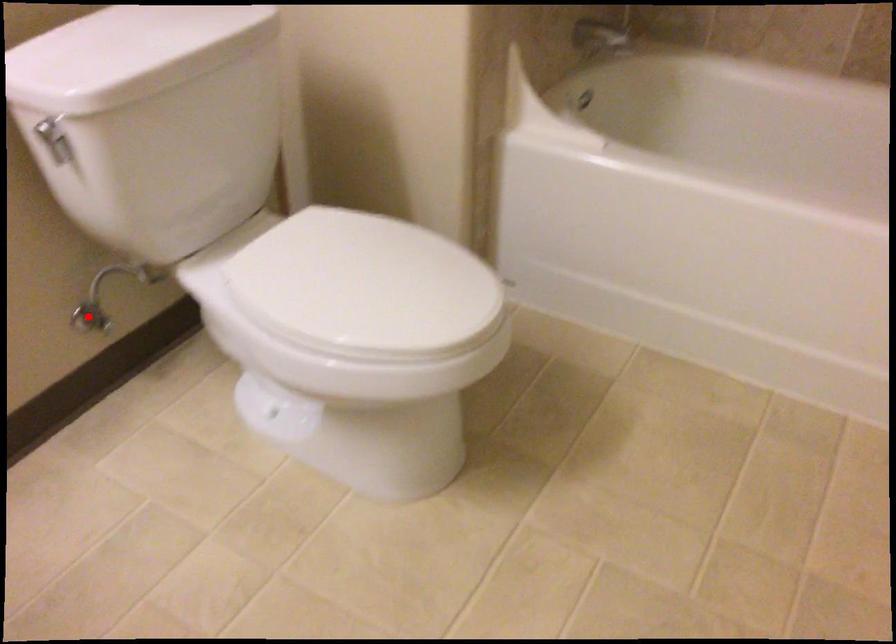
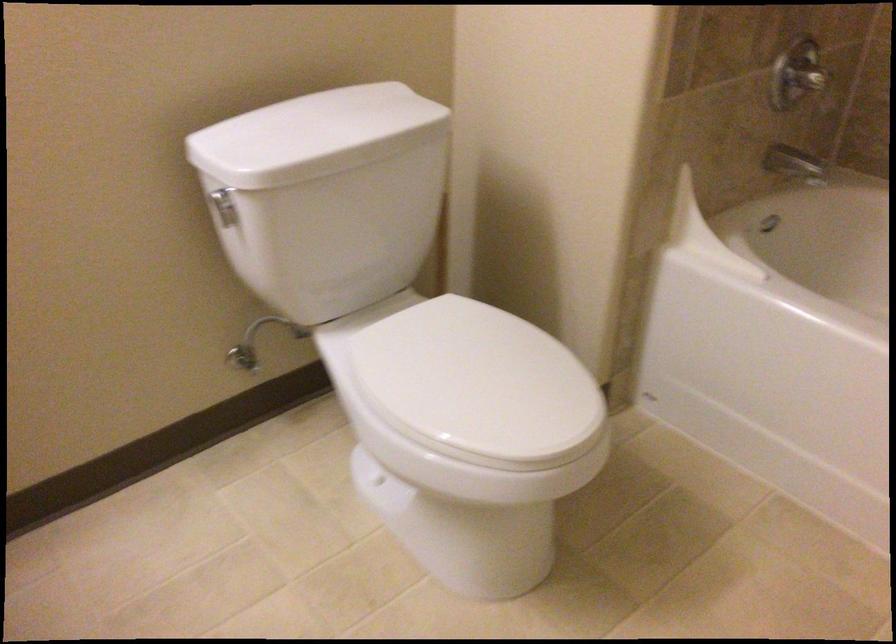
Where in the second image is the point corresponding to the highlighted location from the first image?

(243, 357)